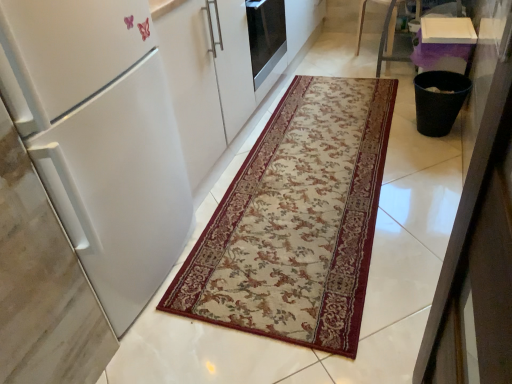
Question: Is beige floral rug at center taller or shorter than white matte refrigerator at left?

Choices:
 (A) short
 (B) tall

Answer: (A)

Question: Considering the positions of beige floral rug at center and white matte refrigerator at left in the image, is beige floral rug at center wider or thinner than white matte refrigerator at left?

Choices:
 (A) wide
 (B) thin

Answer: (A)

Question: Is beige floral rug at center situated inside white matte refrigerator at left or outside?

Choices:
 (A) outside
 (B) inside

Answer: (A)

Question: From the image's perspective, relative to beige floral rug at center, is white matte refrigerator at left above or below?

Choices:
 (A) below
 (B) above

Answer: (A)

Question: From a real-world perspective, is white matte refrigerator at left positioned above or below beige floral rug at center?

Choices:
 (A) above
 (B) below

Answer: (A)

Question: Is white matte refrigerator at left taller or shorter than beige floral rug at center?

Choices:
 (A) tall
 (B) short

Answer: (A)

Question: Does point (50, 46) appear closer or farther from the camera than point (302, 163)?

Choices:
 (A) farther
 (B) closer

Answer: (B)